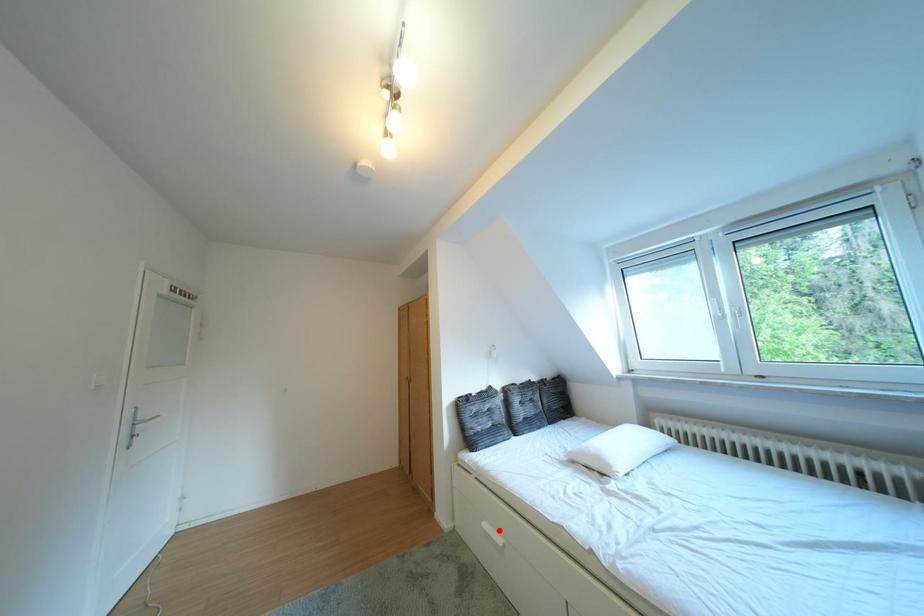
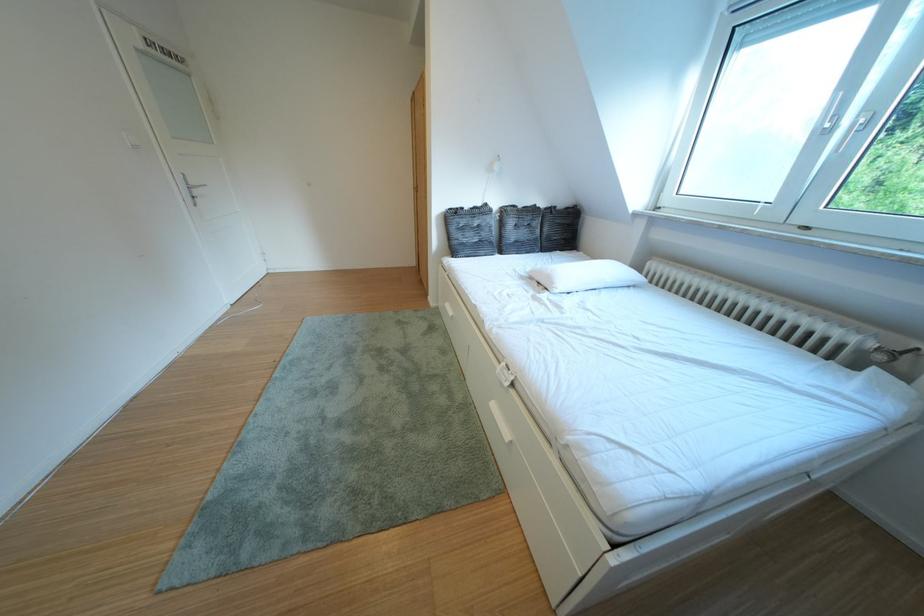
Question: I am providing you with two images of the same scene from different viewpoints. Image1 has a red point marked. In image2, the corresponding 3D location appears at what relative position? Reply with the corresponding letter.

Choices:
 (A) Closer
 (B) Farther

Answer: (A)